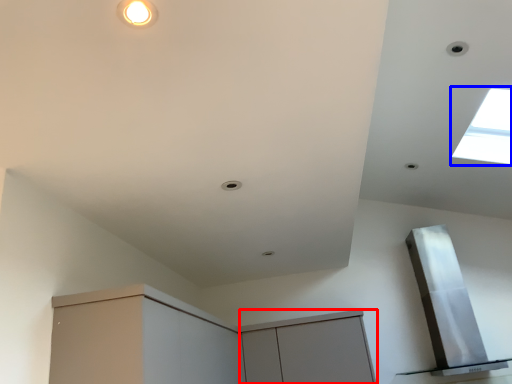
Question: Which object is further to the camera taking this photo, cabinetry (highlighted by a red box) or window (highlighted by a blue box)?

Choices:
 (A) cabinetry
 (B) window

Answer: (A)